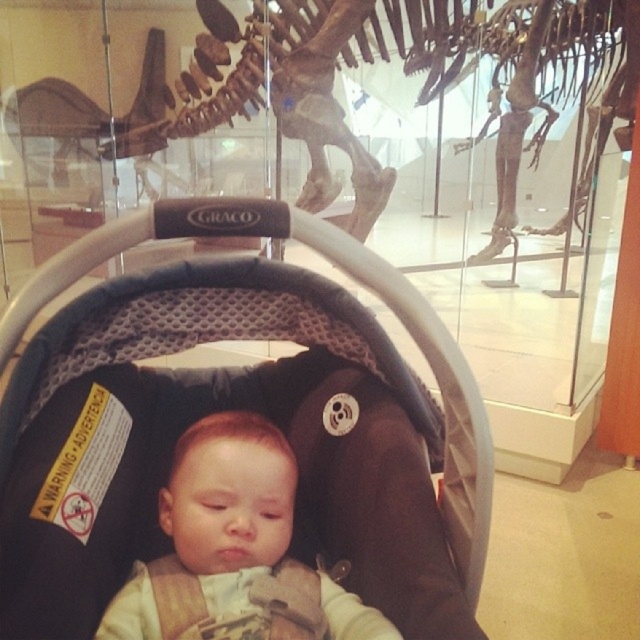
Can you confirm if black mesh car seat at center is shorter than bone-like skeleton at center?

Yes.

Is black mesh car seat at center below bone-like skeleton at center?

Indeed, black mesh car seat at center is positioned under bone-like skeleton at center.

This screenshot has height=640, width=640. What do you see at coordinates (236, 408) in the screenshot?
I see `black mesh car seat at center` at bounding box center [236, 408].

The height and width of the screenshot is (640, 640). In order to click on black mesh car seat at center in this screenshot , I will do `click(236, 408)`.

Find the location of a particular element. The height and width of the screenshot is (640, 640). bone-like skeleton at center is located at coordinates (227, 92).

Who is more distant from viewer, (572, 72) or (248, 532)?

Point (572, 72)

The height and width of the screenshot is (640, 640). In order to click on bone-like skeleton at center in this screenshot , I will do `click(227, 92)`.

Between point (113, 577) and point (214, 566), which one is positioned behind?

Point (113, 577)

Based on the photo, which is above, black mesh car seat at center or smooth beige baby at center?

black mesh car seat at center is above.

Locate an element on the screen. black mesh car seat at center is located at coordinates (236, 408).